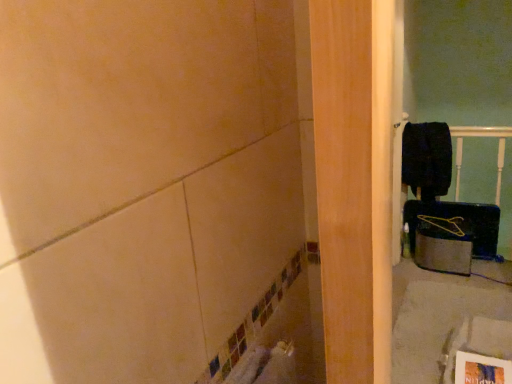
Question: Is yellow plastic hanger at right not near black matte laundry at upper right?

Choices:
 (A) no
 (B) yes

Answer: (A)

Question: Can you confirm if yellow plastic hanger at right is bigger than black matte laundry at upper right?

Choices:
 (A) no
 (B) yes

Answer: (A)

Question: Is yellow plastic hanger at right to the right of black matte laundry at upper right from the viewer's perspective?

Choices:
 (A) no
 (B) yes

Answer: (B)

Question: Is yellow plastic hanger at right positioned beyond the bounds of black matte laundry at upper right?

Choices:
 (A) no
 (B) yes

Answer: (B)

Question: Would you say yellow plastic hanger at right contains black matte laundry at upper right?

Choices:
 (A) yes
 (B) no

Answer: (B)

Question: Considering the relative sizes of yellow plastic hanger at right and black matte laundry at upper right in the image provided, is yellow plastic hanger at right wider than black matte laundry at upper right?

Choices:
 (A) yes
 (B) no

Answer: (A)

Question: Is black matte laundry at upper right far from yellow plastic hanger at right?

Choices:
 (A) no
 (B) yes

Answer: (A)

Question: From a real-world perspective, is black matte laundry at upper right on top of yellow plastic hanger at right?

Choices:
 (A) no
 (B) yes

Answer: (B)

Question: Considering the relative sizes of black matte laundry at upper right and yellow plastic hanger at right in the image provided, is black matte laundry at upper right taller than yellow plastic hanger at right?

Choices:
 (A) no
 (B) yes

Answer: (B)

Question: From a real-world perspective, is black matte laundry at upper right physically below yellow plastic hanger at right?

Choices:
 (A) yes
 (B) no

Answer: (B)

Question: Can you confirm if black matte laundry at upper right is positioned to the right of yellow plastic hanger at right?

Choices:
 (A) yes
 (B) no

Answer: (B)

Question: From the image's perspective, is black matte laundry at upper right above yellow plastic hanger at right?

Choices:
 (A) yes
 (B) no

Answer: (A)

Question: Is yellow plastic hanger at right to the left or to the right of black matte laundry at upper right in the image?

Choices:
 (A) right
 (B) left

Answer: (A)